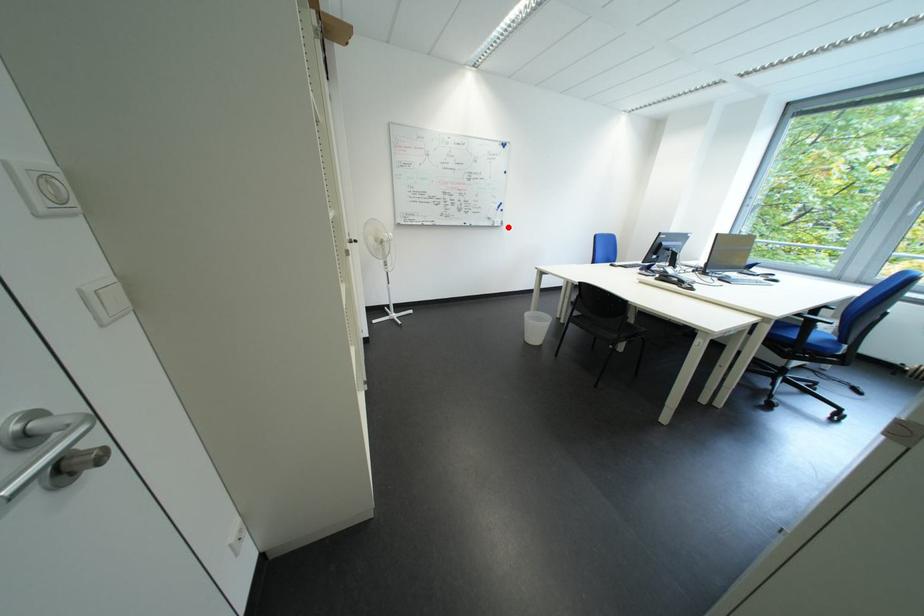
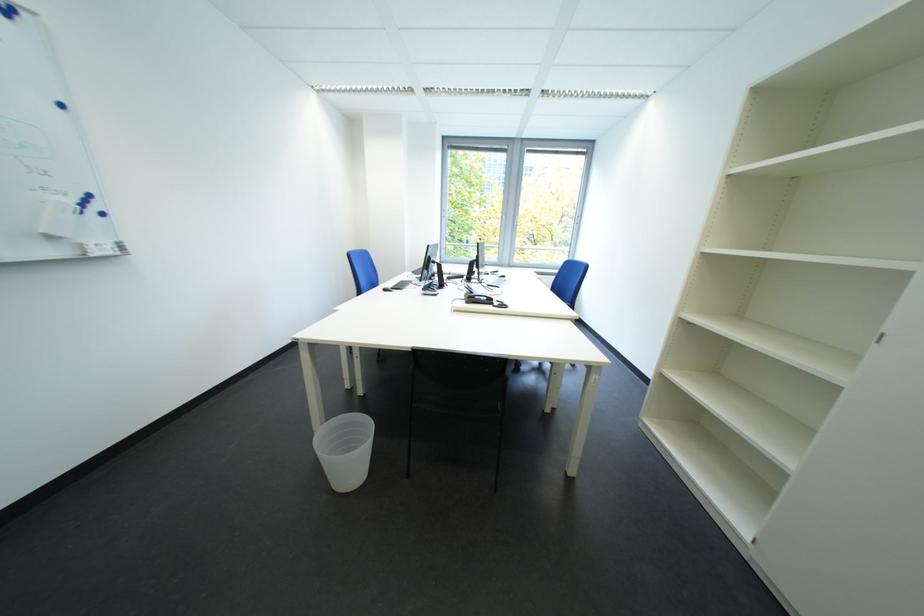
Where in the second image is the point corresponding to the highlighted location from the first image?

(108, 256)